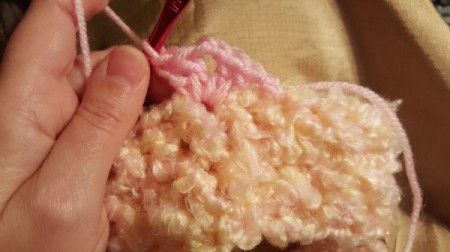
This screenshot has height=252, width=450. What are the coordinates of `fabric` in the screenshot? It's located at [x=246, y=158], [x=299, y=30].